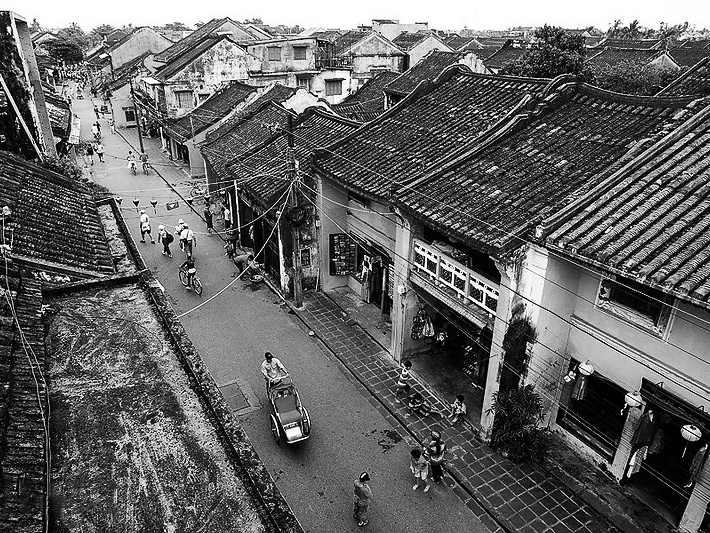
Locate an element on the screen. This screenshot has height=533, width=710. japanese lanterns is located at coordinates (152, 201), (135, 200).